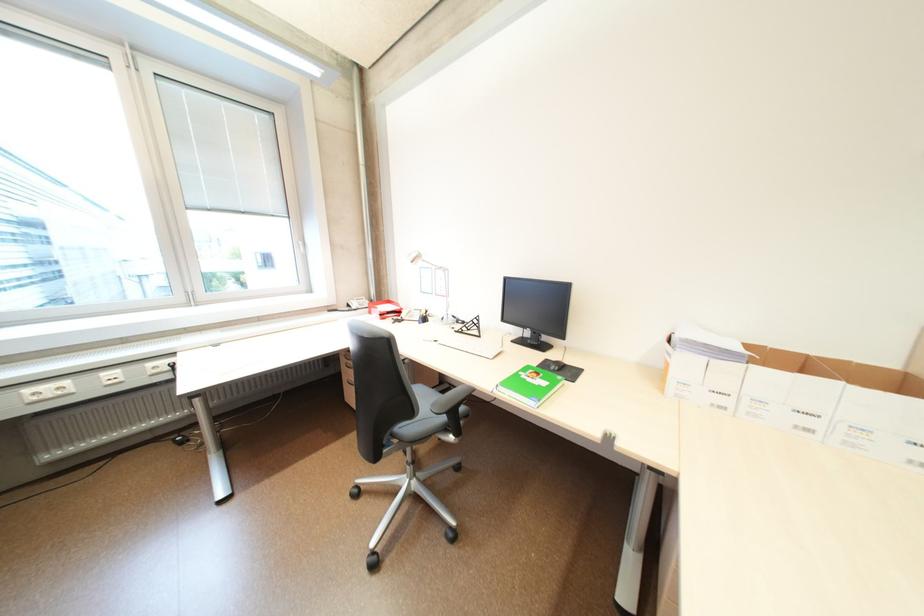
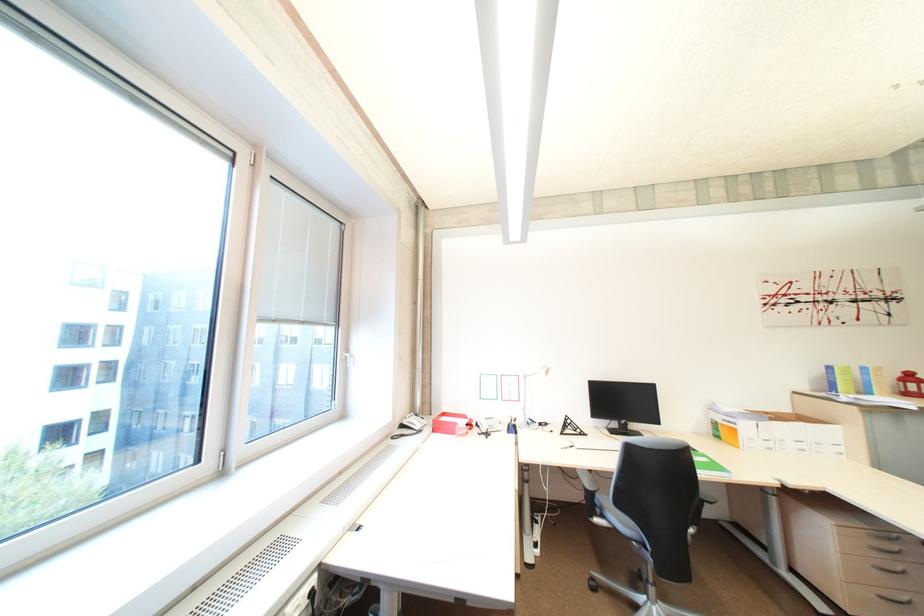
The point at (x=398, y=302) is marked in the first image. Where is the corresponding point in the second image?

(454, 415)